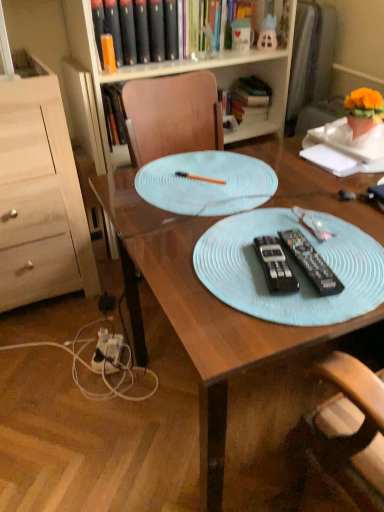
Where is `free space behind black plastic remote control at center, the 2th remote control positioned from the left`? The width and height of the screenshot is (384, 512). free space behind black plastic remote control at center, the 2th remote control positioned from the left is located at coordinates (292, 219).